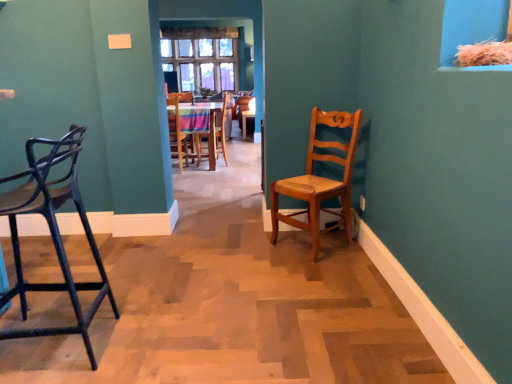
Locate an element on the screen. This screenshot has height=384, width=512. vacant space in matte black stool at left, the 5th chair viewed from the back (from a real-world perspective) is located at coordinates (56, 342).